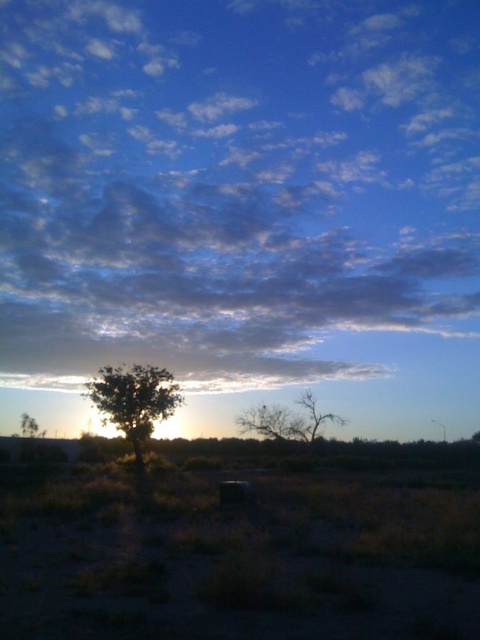
Can you confirm if cloudy blue sky at upper center is positioned above brown textured tree at center?

Indeed, cloudy blue sky at upper center is positioned over brown textured tree at center.

Is cloudy blue sky at upper center to the left of brown textured tree at center from the viewer's perspective?

Indeed, cloudy blue sky at upper center is positioned on the left side of brown textured tree at center.

Is point (249, 316) more distant than point (280, 420)?

Yes, it is behind point (280, 420).

Image resolution: width=480 pixels, height=640 pixels. What are the coordinates of `cloudy blue sky at upper center` in the screenshot? It's located at (231, 182).

Between point (350, 106) and point (32, 419), which one is positioned in front?

Positioned in front is point (32, 419).

Who is lower down, cloudy blue sky at upper center or green matte tree at left?

green matte tree at left

Is point (118, 65) positioned after point (37, 426)?

Yes, it is behind point (37, 426).

Where is `cloudy blue sky at upper center`? This screenshot has width=480, height=640. cloudy blue sky at upper center is located at coordinates point(231,182).

Where is `cloudy blue sky at upper center`? The height and width of the screenshot is (640, 480). cloudy blue sky at upper center is located at coordinates (231, 182).

Is cloudy blue sky at upper center bigger than green leafy tree at center?

Indeed, cloudy blue sky at upper center has a larger size compared to green leafy tree at center.

Where is `cloudy blue sky at upper center`? This screenshot has height=640, width=480. cloudy blue sky at upper center is located at coordinates (231, 182).

You are a GUI agent. You are given a task and a screenshot of the screen. Output one action in this format:
    pyautogui.click(x=<x>, y=<y>)
    Task: Click on the cloudy blue sky at upper center
    This screenshot has width=480, height=640.
    Given the screenshot: What is the action you would take?
    pyautogui.click(x=231, y=182)